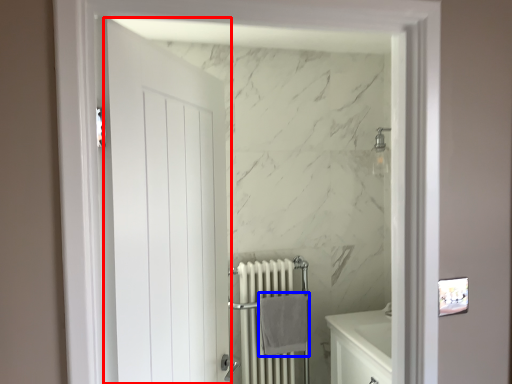
Question: Which point is further to the camera, door (highlighted by a red box) or bath towel (highlighted by a blue box)?

Choices:
 (A) door
 (B) bath towel

Answer: (B)